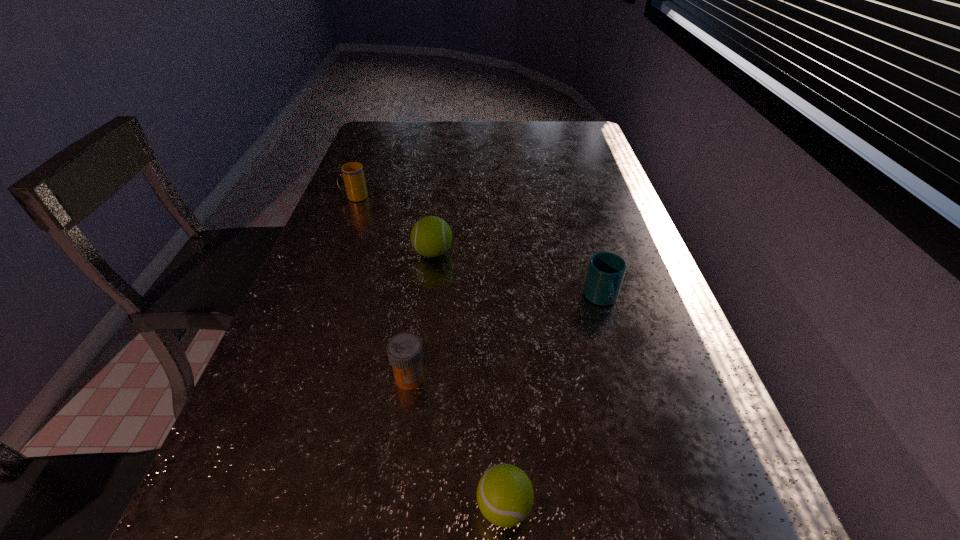
Locate an element on the screen. The width and height of the screenshot is (960, 540). the second closest object to the right tennis ball is located at coordinates (606, 270).

At what (x,y) coordinates should I click in order to perform the action: click on free location that satisfies the following two spatial constraints: 1. on the label side of the medicine; 2. on the left side of the nearer tennis ball. Please return your answer as a coordinate pair (x, y). The width and height of the screenshot is (960, 540). Looking at the image, I should click on (392, 507).

The height and width of the screenshot is (540, 960). What are the coordinates of `blank space that satisfies the following two spatial constraints: 1. on the label side of the right tennis ball; 2. on the right side of the second nearest object` in the screenshot? It's located at (392, 507).

Locate an element on the screen. The image size is (960, 540). free space that satisfies the following two spatial constraints: 1. on the label side of the right tennis ball; 2. on the right side of the fourth farthest object is located at coordinates (392, 507).